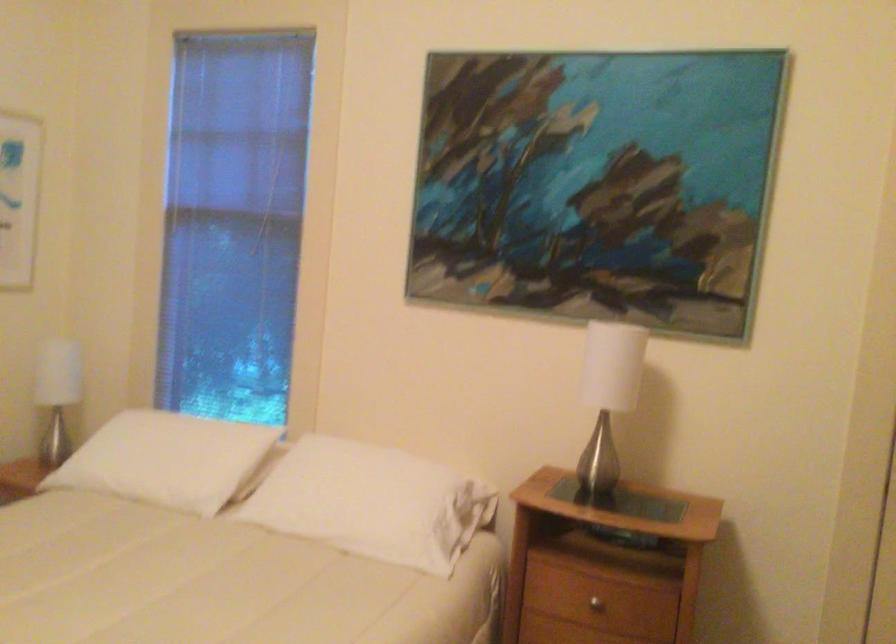
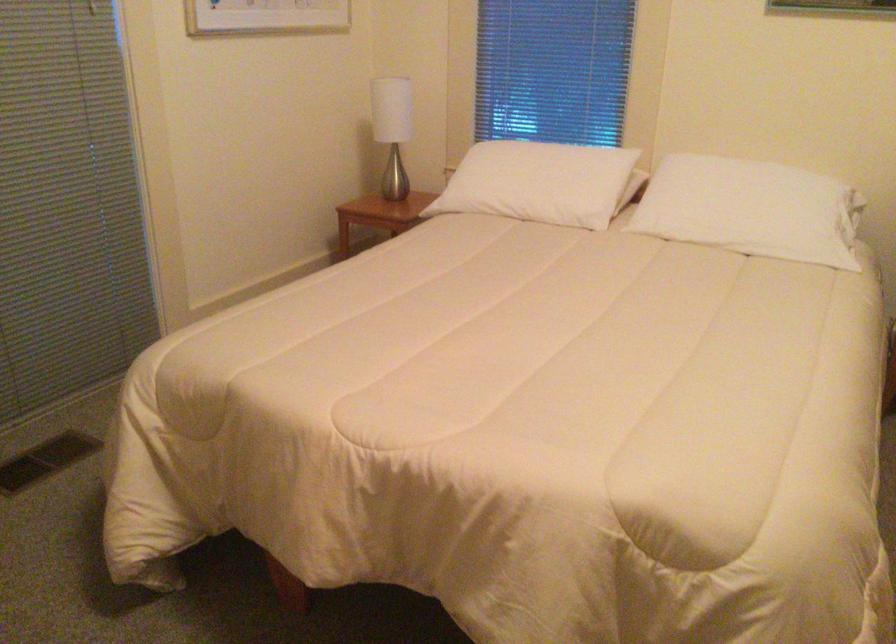
In the second image, find the point that corresponds to (350,512) in the first image.

(752, 210)